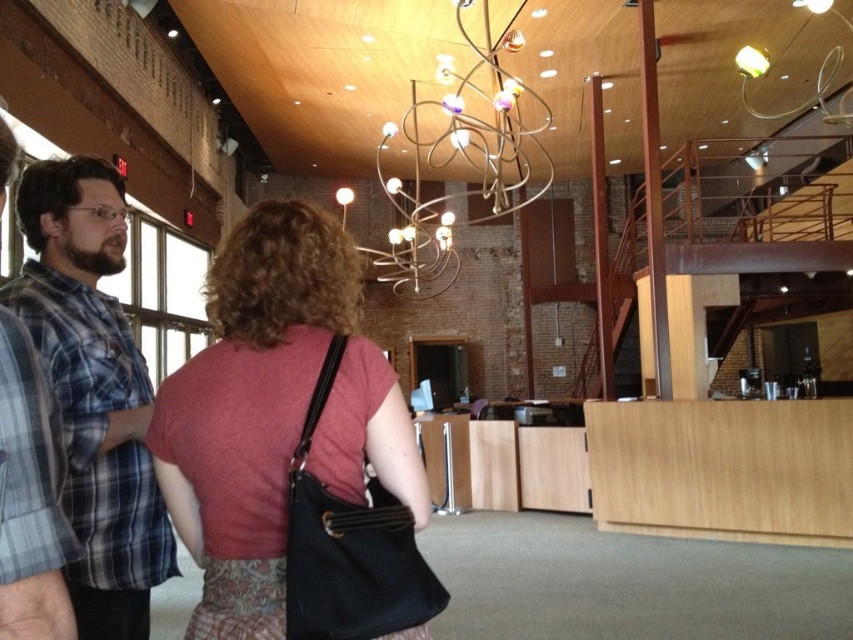
You are standing in the office and see the point marked at coordinates (x=273, y=412). What object is located at that point?

The point at coordinates (x=273, y=412) marks the location of the matte black purse at center.

You are standing in the office and want to reach the matte black purse at center without moving the plaid fabric shirt at left. Is this possible?

The plaid fabric shirt at left is behind the matte black purse at center, so you can reach the matte black purse at center without moving the plaid fabric shirt at left because it is already positioned behind it.